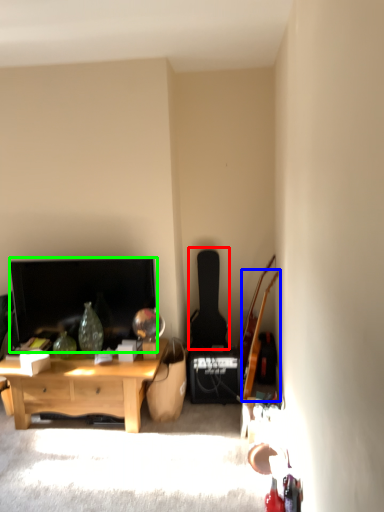
Question: Which object is positioned closest to guitar (highlighted by a red box)? Select from guitar (highlighted by a blue box) and television (highlighted by a green box).

Choices:
 (A) guitar
 (B) television

Answer: (A)